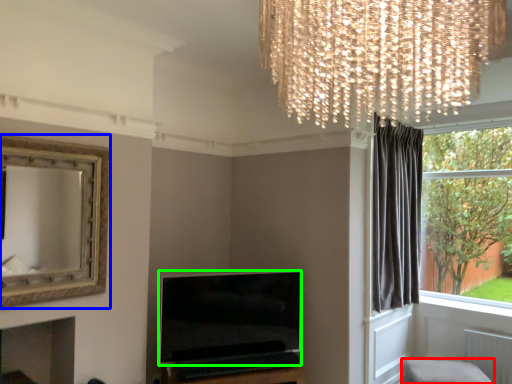
Question: Which object is the closest to the furniture (highlighted by a red box)? Choose among these: picture frame (highlighted by a blue box) or television (highlighted by a green box).

Choices:
 (A) picture frame
 (B) television

Answer: (B)